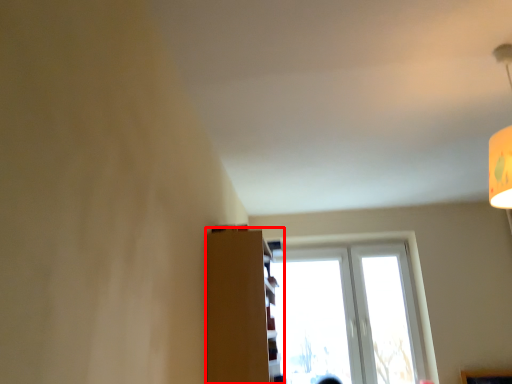
Question: Where is shelf (annotated by the red box) located in relation to window in the image?

Choices:
 (A) right
 (B) left

Answer: (B)